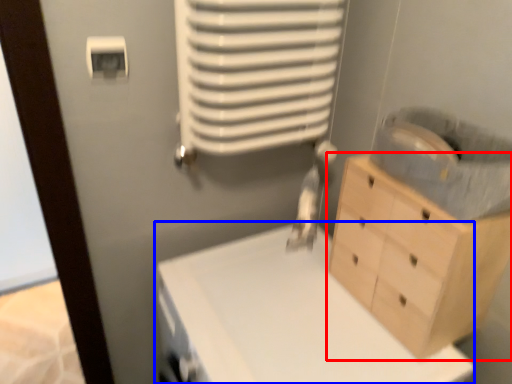
Question: Which object appears closest to the camera in this image, chest of drawers (highlighted by a red box) or changing table (highlighted by a blue box)?

Choices:
 (A) chest of drawers
 (B) changing table

Answer: (B)